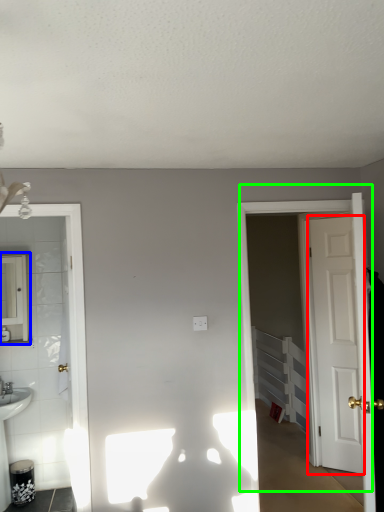
Question: Which object is the closest to the door (highlighted by a red box)? Choose among these: mirror (highlighted by a blue box) or door (highlighted by a green box).

Choices:
 (A) mirror
 (B) door

Answer: (B)